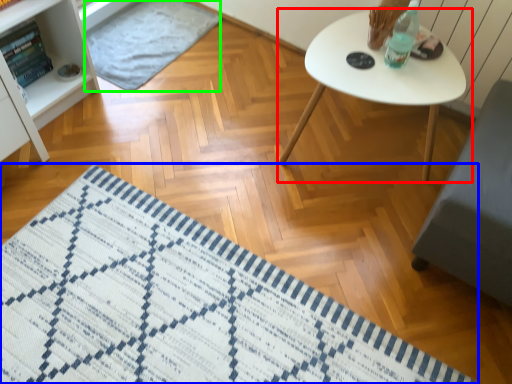
Question: Considering the real-world distances, which object is closest to table (highlighted by a red box)? mat (highlighted by a blue box) or mat (highlighted by a green box).

Choices:
 (A) mat
 (B) mat

Answer: (A)